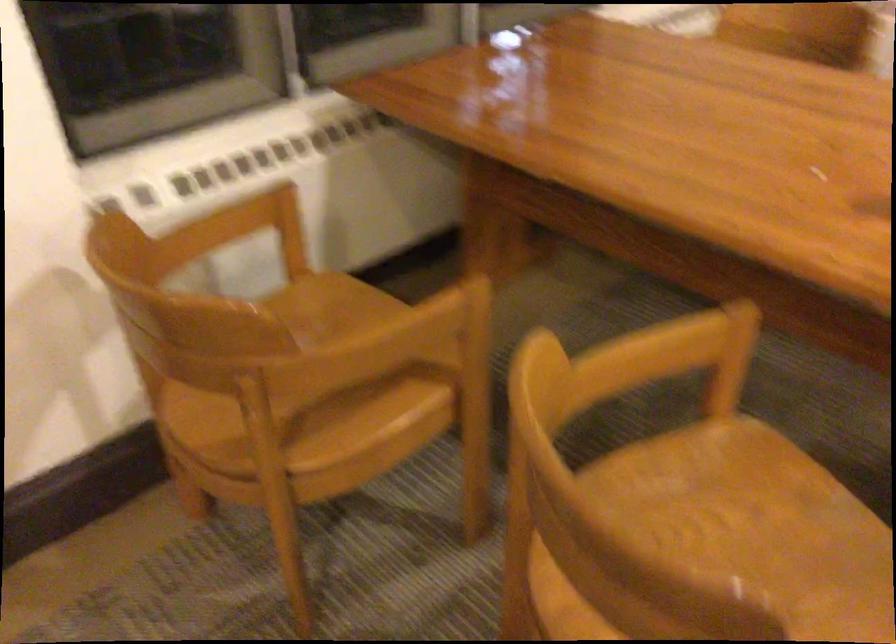
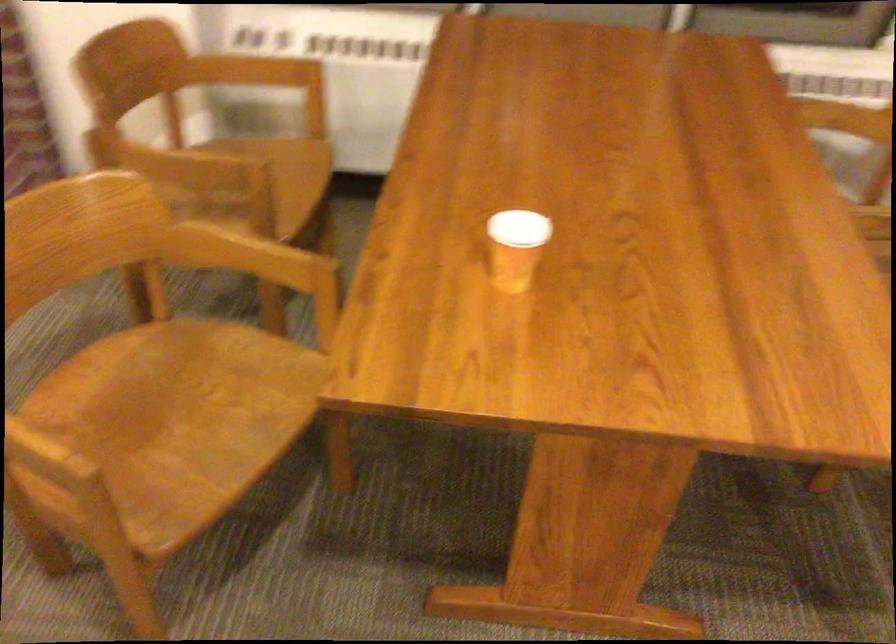
Locate, in the second image, the point that corresponds to (x=478, y=307) in the first image.

(252, 182)